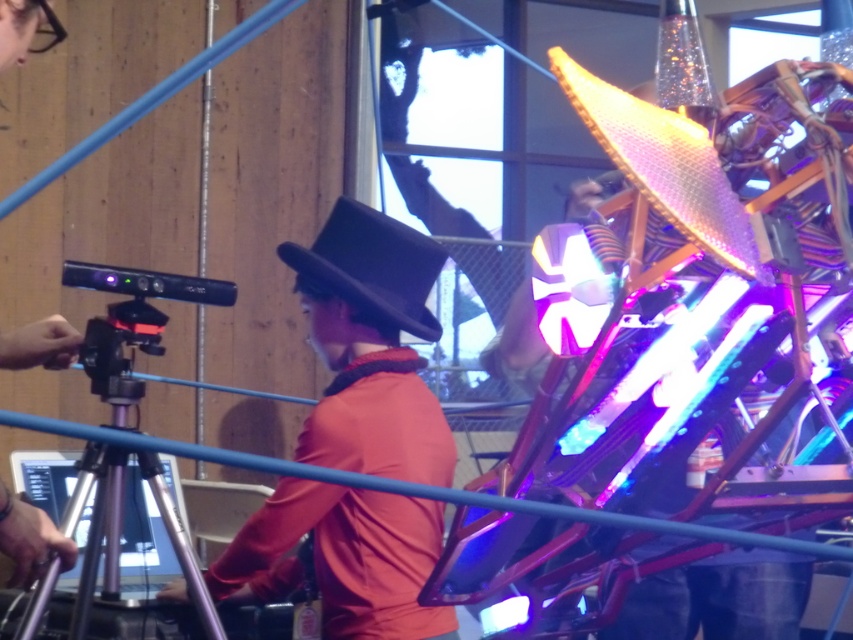
You are at the tech exhibition and want to take a photo of the structure with the person in the red shirt and black hat. You have a camera on a tripod at point (318, 234). Is the person in the red shirt and black hat at point (409, 388) blocking your view of the structure?

Point (409, 388) is in front of point (318, 234), so the person at point (409, 388) is blocking the view of the structure from the camera at point (318, 234).

You are at the event and notice two hats at the center of the scene. Which hat is positioned lower between the matte black hat at center and the black felt hat at center?

The matte black hat at center is positioned below the black felt hat at center, so it is lower.